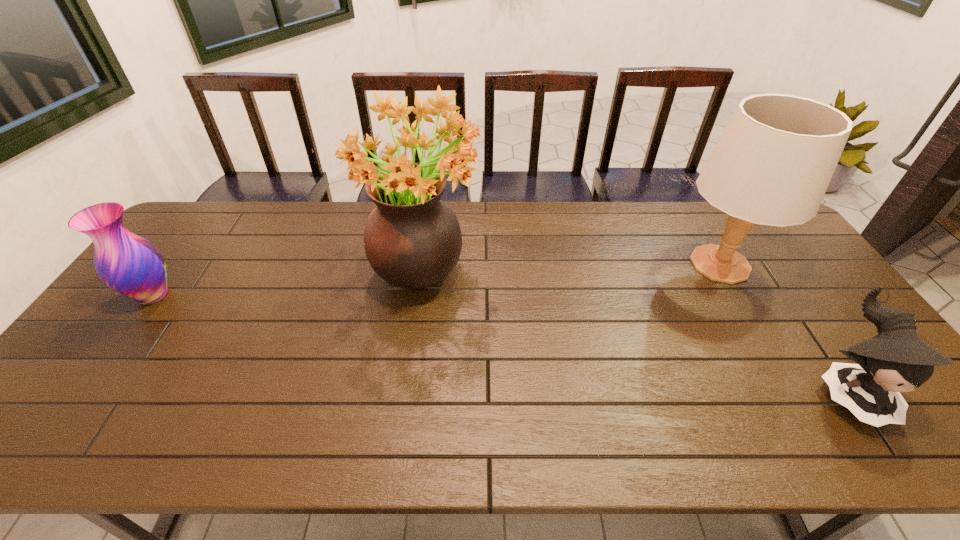
Identify the location of blank area at the near right corner. (888, 443).

Locate an element on the screen. free space between the vase and the second object from left to right is located at coordinates (289, 281).

At what (x,y) coordinates should I click in order to perform the action: click on vacant area between the third object from right to left and the leftmost object. Please return your answer as a coordinate pair (x, y). The image size is (960, 540). Looking at the image, I should click on (289, 281).

Locate an element on the screen. This screenshot has height=540, width=960. vacant area that lies between the nearest object and the table lamp is located at coordinates (783, 327).

I want to click on free space between the vase and the flower arrangement, so click(289, 281).

Locate an element on the screen. The image size is (960, 540). empty space between the third object from right to left and the vase is located at coordinates (289, 281).

At what (x,y) coordinates should I click in order to perform the action: click on empty space that is in between the second object from left to right and the nearest object. Please return your answer as a coordinate pair (x, y). This screenshot has height=540, width=960. Looking at the image, I should click on coord(636,328).

You are a GUI agent. You are given a task and a screenshot of the screen. Output one action in this format:
    pyautogui.click(x=<x>, y=<y>)
    Task: Click on the vacant space in between the vase and the doll
    Image resolution: width=960 pixels, height=540 pixels.
    Given the screenshot: What is the action you would take?
    pyautogui.click(x=500, y=342)

At what (x,y) coordinates should I click in order to perform the action: click on free spot between the third object from right to left and the table lamp. Please return your answer as a coordinate pair (x, y). Looking at the image, I should click on (572, 265).

Find the location of `object that is the nearest to the vase`. object that is the nearest to the vase is located at coordinates (412, 239).